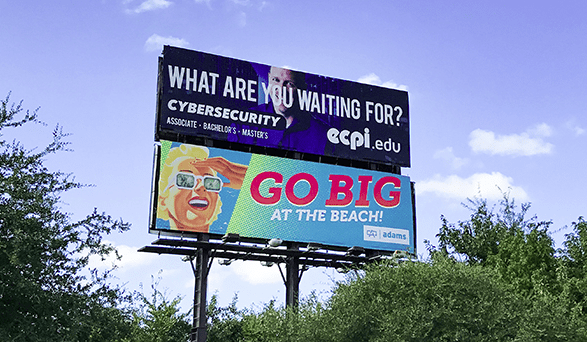
Where is `support beams`? This screenshot has width=587, height=342. support beams is located at coordinates (195, 285), (291, 286).